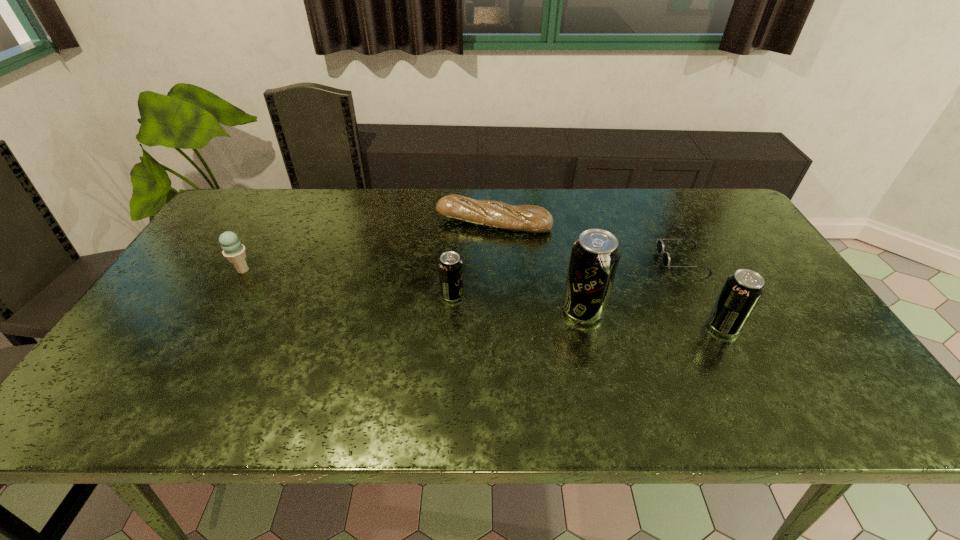
Where is `vacant space in between the leftmost object and the second tallest object`? The image size is (960, 540). vacant space in between the leftmost object and the second tallest object is located at coordinates (483, 298).

This screenshot has height=540, width=960. Find the location of `free space that is in between the tallest object and the farthest object`. free space that is in between the tallest object and the farthest object is located at coordinates (539, 266).

Locate an element on the screen. free point between the tallest object and the second shortest soda can is located at coordinates (653, 318).

Identify which object is the fourth closest to the leftmost object. Please provide its 2D coordinates. Your answer should be formatted as a tuple, i.e. [(x, y)], where the tuple contains the x and y coordinates of a point satisfying the conditions above.

[(660, 245)]

Identify the location of the closest object relative to the second tallest soda can. The image size is (960, 540). (660, 245).

Identify which soda can is the closest to the tallest object. Please provide its 2D coordinates. Your answer should be formatted as a tuple, i.e. [(x, y)], where the tuple contains the x and y coordinates of a point satisfying the conditions above.

[(742, 290)]

You are a GUI agent. You are given a task and a screenshot of the screen. Output one action in this format:
    pyautogui.click(x=<x>, y=<y>)
    Task: Click on the soda can that is the second nearest to the sunglasses
    
    Given the screenshot: What is the action you would take?
    pyautogui.click(x=595, y=255)

Find the location of `free location that satisfies the following two spatial constraints: 1. on the front side of the second tallest soda can; 2. on the left side of the farthest object`. free location that satisfies the following two spatial constraints: 1. on the front side of the second tallest soda can; 2. on the left side of the farthest object is located at coordinates (497, 326).

Identify the location of vacant region that satisfies the following two spatial constraints: 1. on the front side of the farthest object; 2. on the left side of the second shortest soda can. (497, 326).

Image resolution: width=960 pixels, height=540 pixels. I want to click on vacant area that satisfies the following two spatial constraints: 1. on the front side of the fifth shortest object; 2. on the right side of the second shortest object, so click(497, 326).